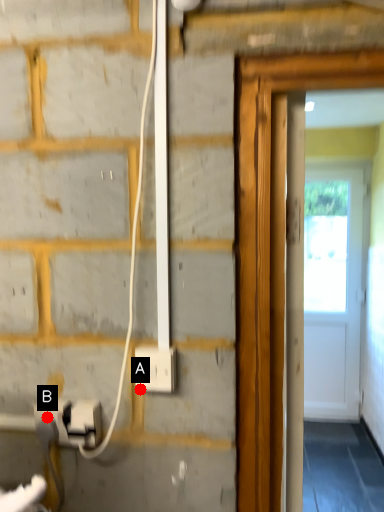
Question: Two points are circled on the image, labeled by A and B beside each circle. Which point appears closest to the camera in this image?

Choices:
 (A) A is closer
 (B) B is closer

Answer: (B)